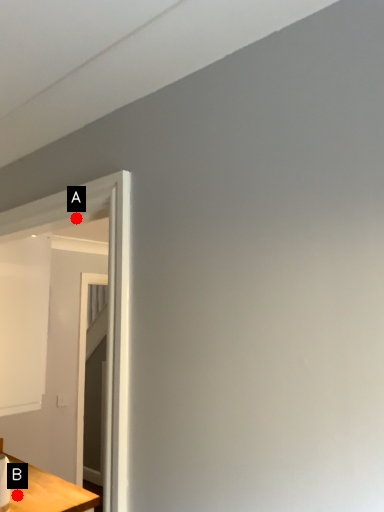
Question: Two points are circled on the image, labeled by A and B beside each circle. Which point is further to the camera?

Choices:
 (A) A is further
 (B) B is further

Answer: (B)